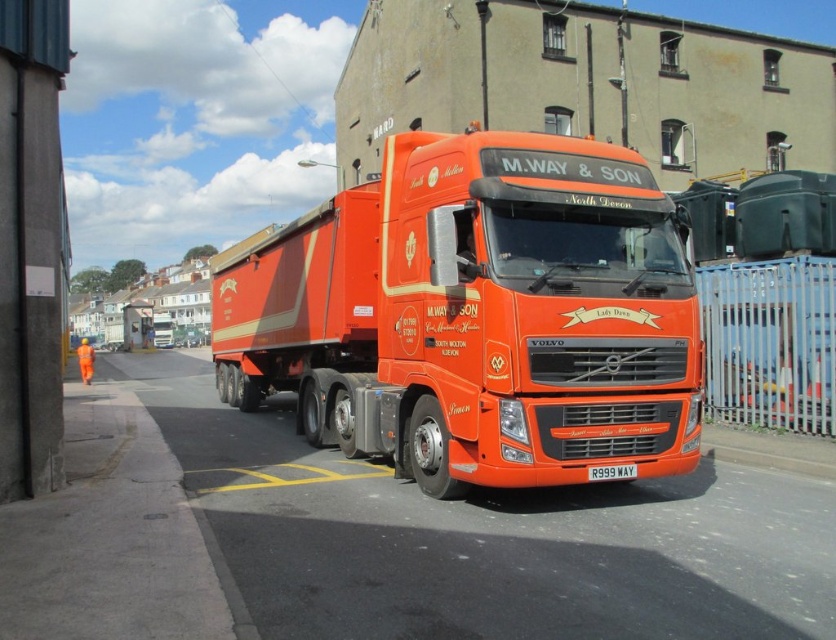
Question: Does matte orange truck at center come behind white plastic license plate at center?

Choices:
 (A) yes
 (B) no

Answer: (B)

Question: Does matte orange truck at center have a smaller size compared to white plastic license plate at center?

Choices:
 (A) no
 (B) yes

Answer: (A)

Question: Among these objects, which one is nearest to the camera?

Choices:
 (A) white plastic license plate at center
 (B) matte orange truck at center

Answer: (B)

Question: Which point is closer to the camera taking this photo?

Choices:
 (A) (627, 468)
 (B) (414, 260)

Answer: (A)

Question: From the image, what is the correct spatial relationship of matte orange truck at center in relation to white plastic license plate at center?

Choices:
 (A) right
 (B) left

Answer: (B)